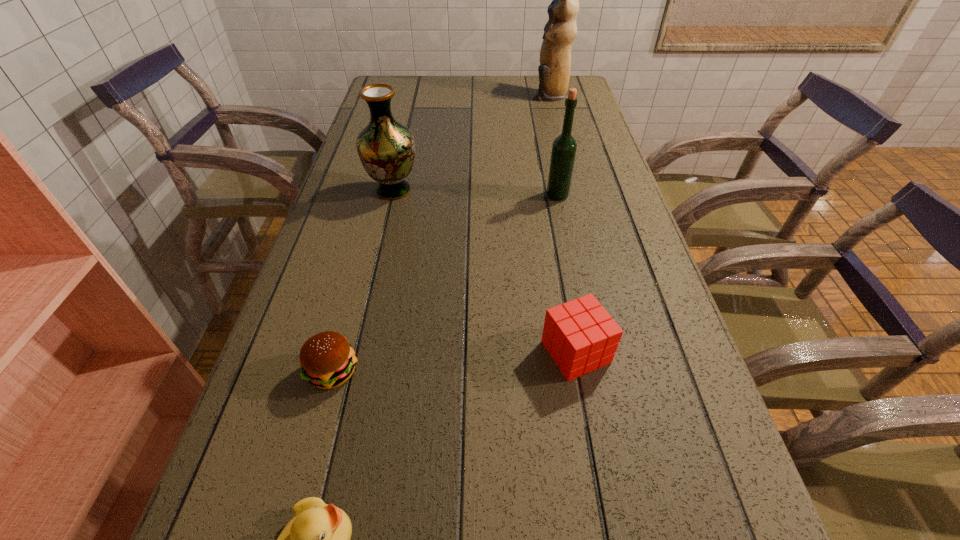
Select which object appears as the closest to the cube. Please provide its 2D coordinates. Your answer should be formatted as a tuple, i.e. [(x, y)], where the tuple contains the x and y coordinates of a point satisfying the conditions above.

[(327, 360)]

At what (x,y) coordinates should I click in order to perform the action: click on free region that satisfies the following two spatial constraints: 1. on the back side of the cube; 2. on the left side of the liquor. Please return your answer as a coordinate pair (x, y). This screenshot has height=540, width=960. Looking at the image, I should click on (547, 195).